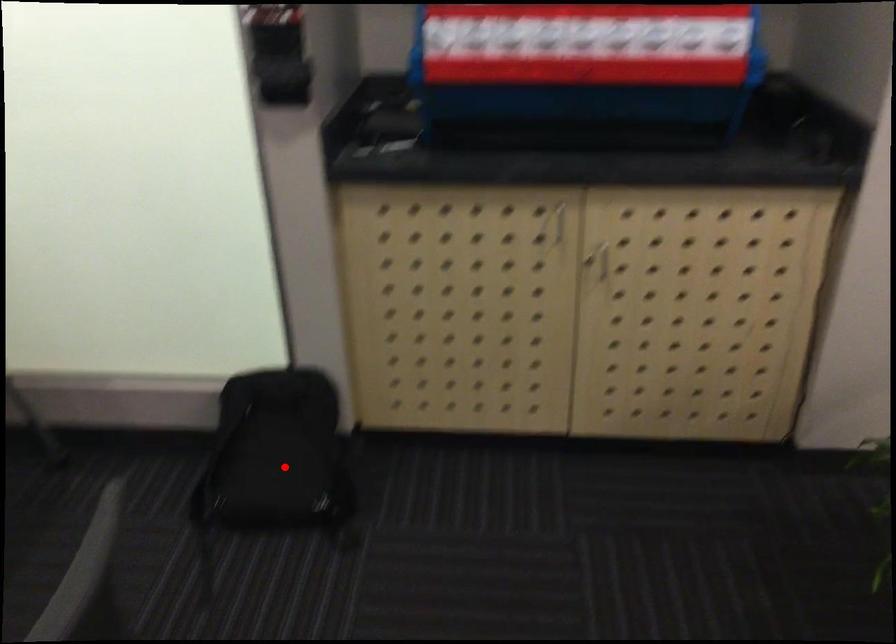
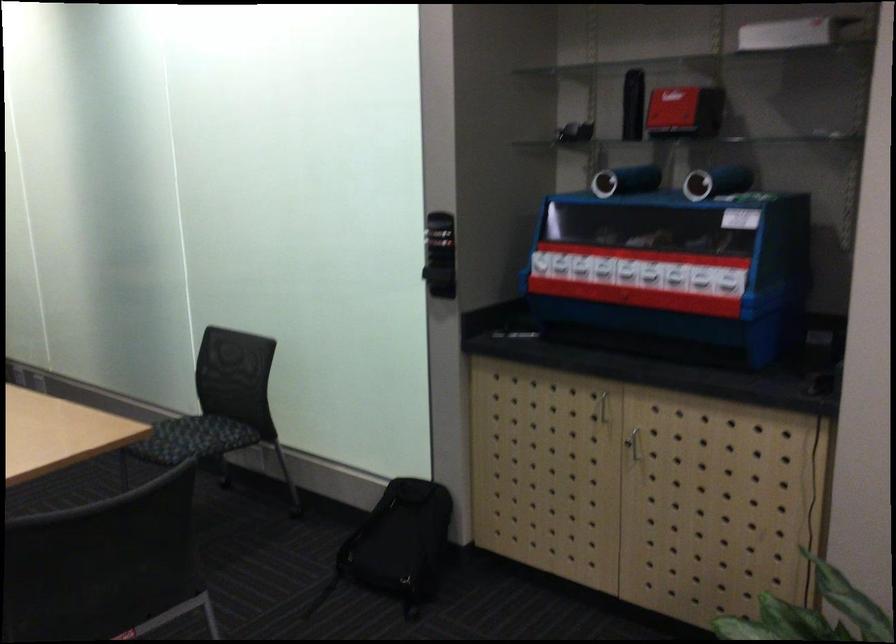
Locate, in the second image, the point that corresponds to the highlighted location in the first image.

(398, 545)